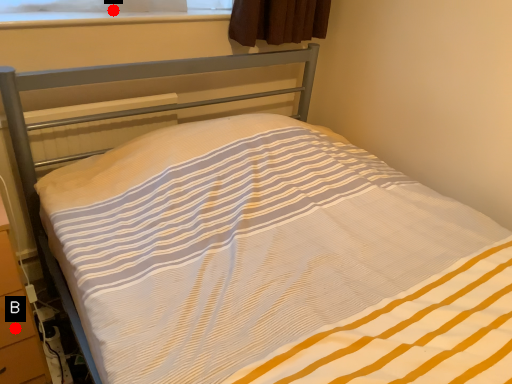
Question: Two points are circled on the image, labeled by A and B beside each circle. Which point is closer to the camera?

Choices:
 (A) A is closer
 (B) B is closer

Answer: (B)